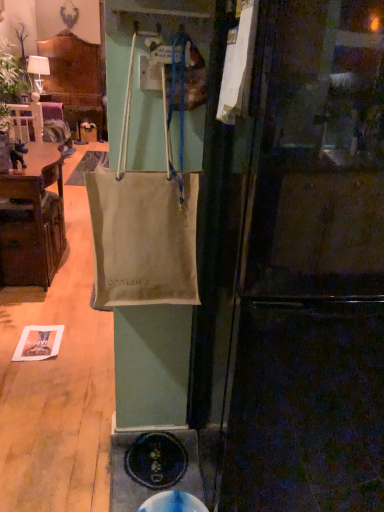
Question: Should I look upward or downward to see matte white lampshade at upper left?

Choices:
 (A) down
 (B) up

Answer: (B)

Question: Considering the relative positions of beige canvas bag at center and matte black refrigerator at center in the image provided, is beige canvas bag at center to the left of matte black refrigerator at center from the viewer's perspective?

Choices:
 (A) yes
 (B) no

Answer: (A)

Question: Is beige canvas bag at center positioned with its back to matte black refrigerator at center?

Choices:
 (A) yes
 (B) no

Answer: (B)

Question: From the image's perspective, is beige canvas bag at center located beneath matte black refrigerator at center?

Choices:
 (A) yes
 (B) no

Answer: (B)

Question: Is beige canvas bag at center wider than matte black refrigerator at center?

Choices:
 (A) yes
 (B) no

Answer: (B)

Question: Would you say beige canvas bag at center is a long distance from matte black refrigerator at center?

Choices:
 (A) no
 (B) yes

Answer: (A)

Question: From a real-world perspective, is beige canvas bag at center positioned over matte black refrigerator at center based on gravity?

Choices:
 (A) no
 (B) yes

Answer: (B)

Question: Can you confirm if matte white lampshade at upper left is bigger than beige canvas bag at center?

Choices:
 (A) no
 (B) yes

Answer: (A)

Question: Does matte white lampshade at upper left have a lesser width compared to beige canvas bag at center?

Choices:
 (A) yes
 (B) no

Answer: (B)

Question: Would you say matte white lampshade at upper left contains beige canvas bag at center?

Choices:
 (A) yes
 (B) no

Answer: (B)

Question: Is matte white lampshade at upper left wider than beige canvas bag at center?

Choices:
 (A) no
 (B) yes

Answer: (B)

Question: Can you confirm if matte white lampshade at upper left is positioned to the right of beige canvas bag at center?

Choices:
 (A) yes
 (B) no

Answer: (B)

Question: From a real-world perspective, is matte white lampshade at upper left positioned over beige canvas bag at center based on gravity?

Choices:
 (A) no
 (B) yes

Answer: (B)

Question: Considering the relative sizes of matte black refrigerator at center and brown wood cabinet at left in the image provided, is matte black refrigerator at center smaller than brown wood cabinet at left?

Choices:
 (A) no
 (B) yes

Answer: (A)